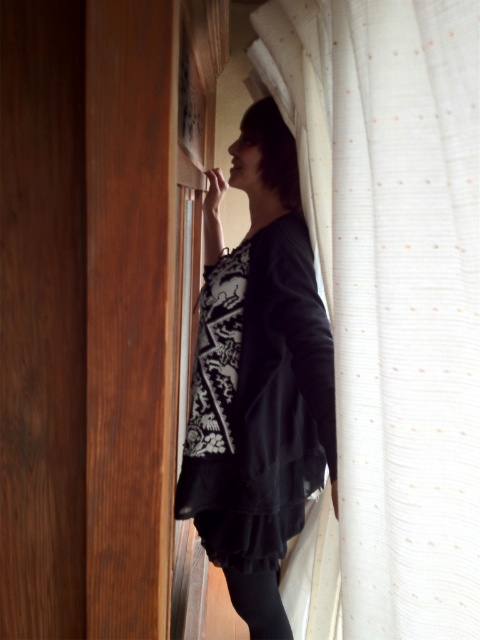
You are organizing a photoshoot and need to ensure that the white sheer curtain at right does not cover the black matte dress at center. Based on their widths, which object should be placed closer to the camera to achieve this?

The white sheer curtain at right has a lesser width compared to the black matte dress at center. To prevent the curtain from covering the dress, position the black matte dress at center closer to the camera since it is wider and will appear larger in the frame.

You are standing in a room and want to reach the white sheer curtain at right to adjust its position. Considering your arm can extend 20 inches, can you reach it without moving your feet?

The white sheer curtain at right is 17.88 inches away from the viewer. Since your arm can extend 20 inches, you can reach it without moving your feet.

You are a fashion designer observing the image. You need to determine the placement of the white sheer curtain at right relative to the black matte dress at center. Can you describe their positions?

The white sheer curtain at right is located above the black matte dress at center.